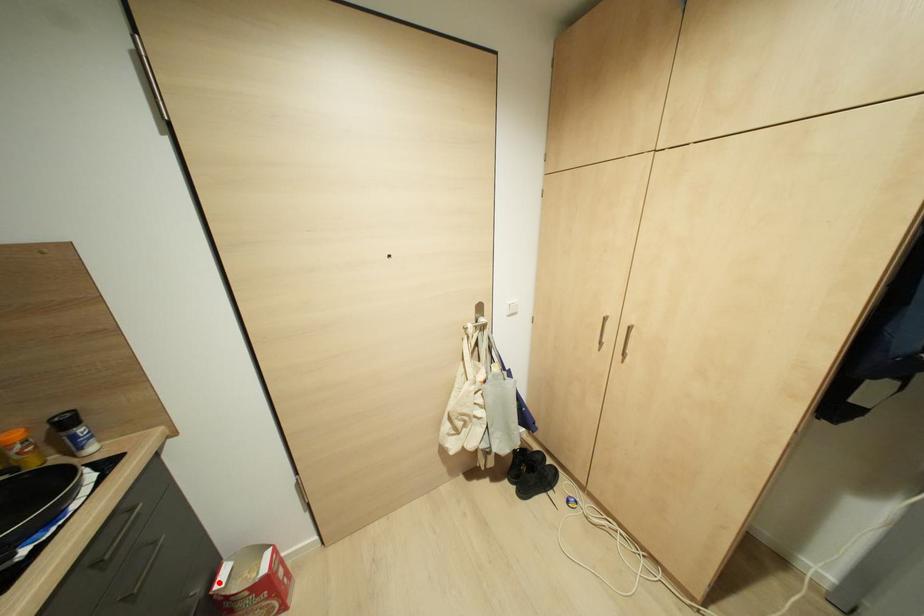
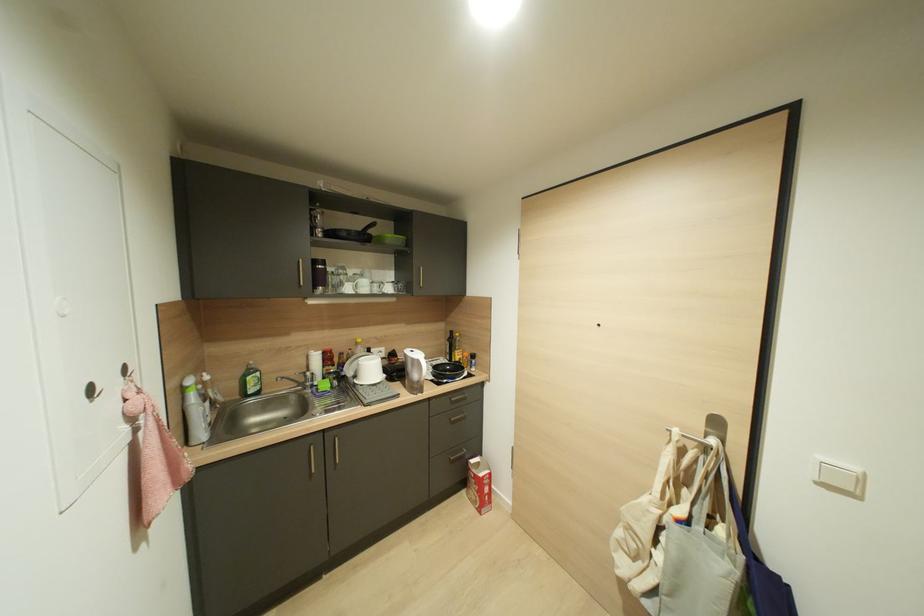
Question: A red point is marked in image1. In image2, is the corresponding 3D point closer to the camera or farther? Reply with the corresponding letter.

Choices:
 (A) The corresponding 3D point is closer.
 (B) The corresponding 3D point is farther.

Answer: (B)